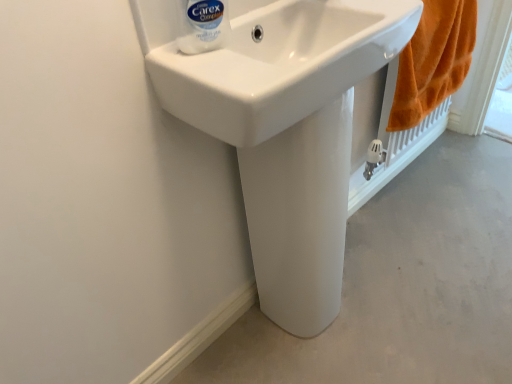
Question: From the image's perspective, is white glossy sink at center located above or below white plastic bottle at upper center?

Choices:
 (A) above
 (B) below

Answer: (B)

Question: Would you say white glossy sink at center is to the left or to the right of white plastic bottle at upper center in the picture?

Choices:
 (A) right
 (B) left

Answer: (A)

Question: Which object is positioned closest to the white plastic bottle at upper center?

Choices:
 (A) orange fluffy towel at right
 (B) white glossy pedestal at center
 (C) white smooth pedestal at center
 (D) white glossy sink at center

Answer: (D)

Question: Which is farther from the white smooth pedestal at center?

Choices:
 (A) white glossy pedestal at center
 (B) orange fluffy towel at right
 (C) white glossy sink at center
 (D) white plastic bottle at upper center

Answer: (D)